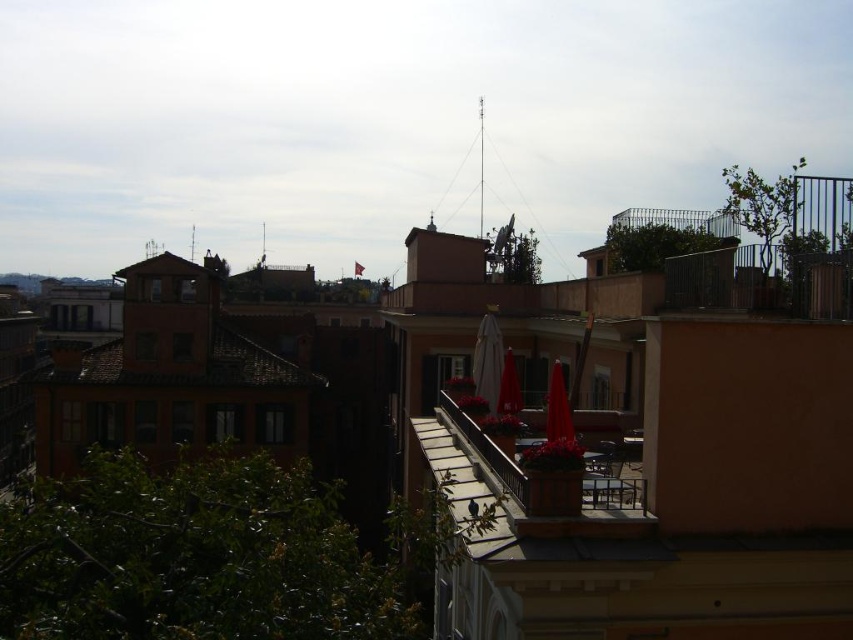
Question: Which object is farther from the camera taking this photo?

Choices:
 (A) matte red umbrella at center-right
 (B) white matte umbrella at center
 (C) terracotta pot at center

Answer: (B)

Question: Is terracotta pot at center further to the viewer compared to red matte umbrella at center?

Choices:
 (A) yes
 (B) no

Answer: (B)

Question: Which object appears closest to the camera in this image?

Choices:
 (A) white matte umbrella at center
 (B) matte red umbrella at center-right
 (C) terracotta pot at center

Answer: (C)

Question: Is terracotta pot at center behind red matte umbrella at center?

Choices:
 (A) no
 (B) yes

Answer: (A)

Question: Is the position of white matte umbrella at center more distant than that of matte red umbrella at center-right?

Choices:
 (A) yes
 (B) no

Answer: (A)

Question: Which object is positioned farthest from the matte red umbrella at center-right?

Choices:
 (A) red matte umbrella at center
 (B) white matte umbrella at center
 (C) terracotta pot at center

Answer: (B)